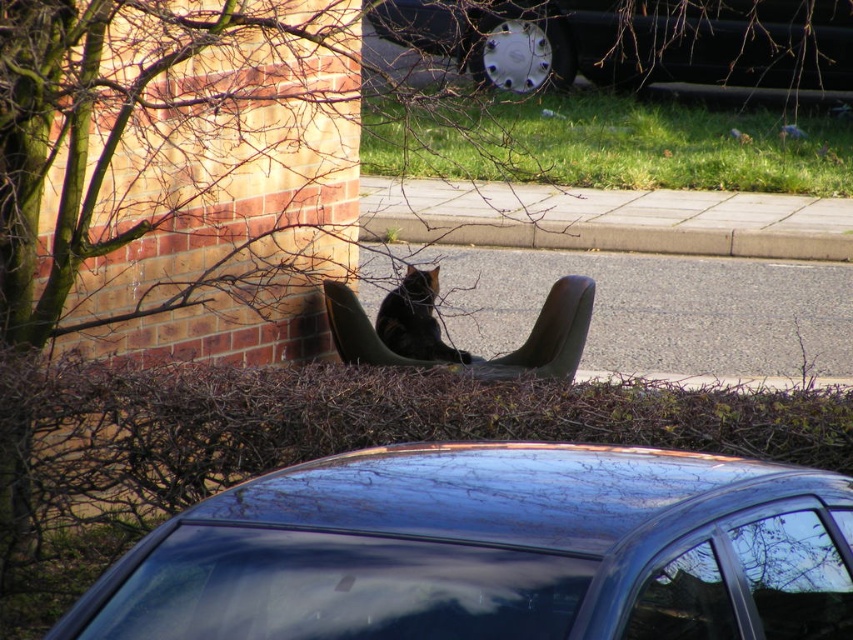
Question: Which is nearer to the brown leather chair at center?

Choices:
 (A) transparent glass car window at center
 (B) glossy metallic car at center

Answer: (B)

Question: Can you confirm if brown leather chair at center is smaller than black fur cat at center?

Choices:
 (A) no
 (B) yes

Answer: (A)

Question: Which of the following is the closest to the observer?

Choices:
 (A) (350, 289)
 (B) (469, 524)
 (C) (424, 298)

Answer: (B)

Question: Does shiny black car at center come in front of brown leather chair at center?

Choices:
 (A) yes
 (B) no

Answer: (B)

Question: Is glossy metallic car at center in front of transparent glass window at lower right?

Choices:
 (A) no
 (B) yes

Answer: (B)

Question: Which object appears closest to the camera in this image?

Choices:
 (A) shiny black car at center
 (B) transparent glass window at lower right
 (C) black fur cat at center
 (D) brown leather chair at center

Answer: (B)